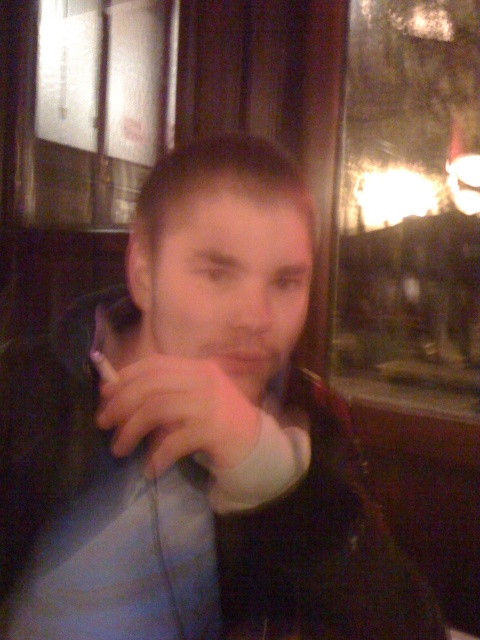
Which of these two, matte black phone at center or white matte hand at center, stands taller?

matte black phone at center is taller.

Does matte black phone at center have a larger size compared to white matte hand at center?

Yes.

Where is `matte black phone at center`? The width and height of the screenshot is (480, 640). matte black phone at center is located at coordinates (193, 438).